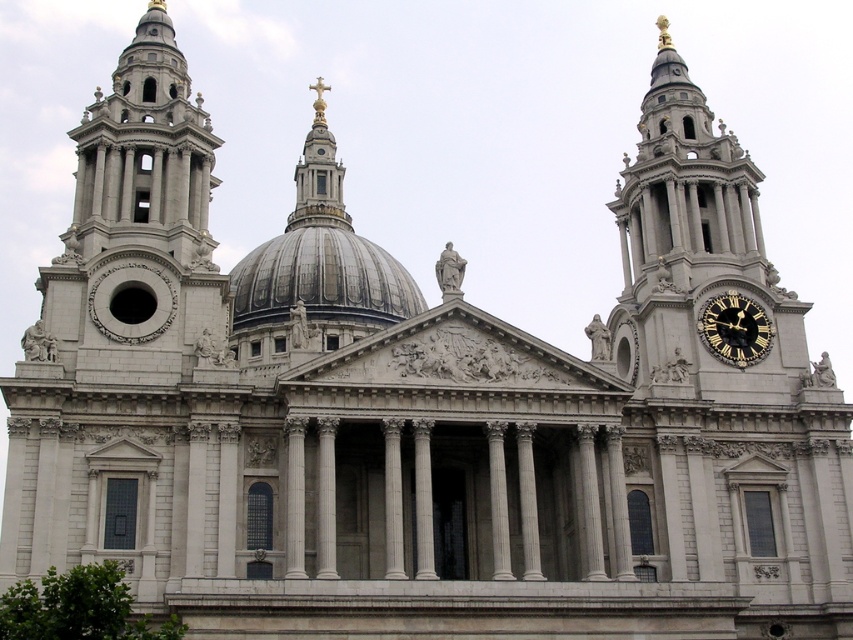
Can you confirm if shiny silver dome at center is shorter than black polished wood clock at right?

In fact, shiny silver dome at center may be taller than black polished wood clock at right.

Which is above, shiny silver dome at center or black polished wood clock at right?

shiny silver dome at center

Locate an element on the screen. shiny silver dome at center is located at coordinates (322, 280).

Where is `shiny silver dome at center`? The width and height of the screenshot is (853, 640). shiny silver dome at center is located at coordinates (322, 280).